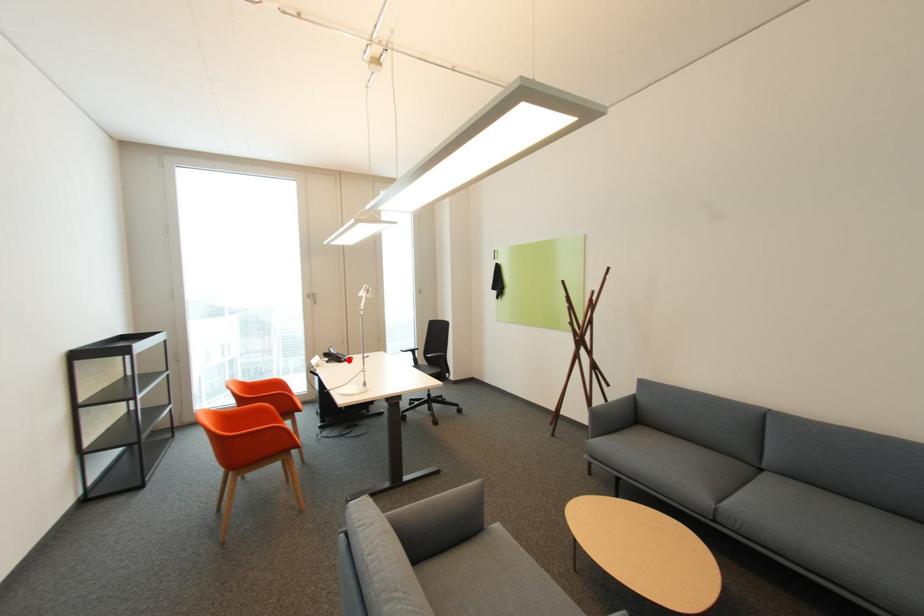
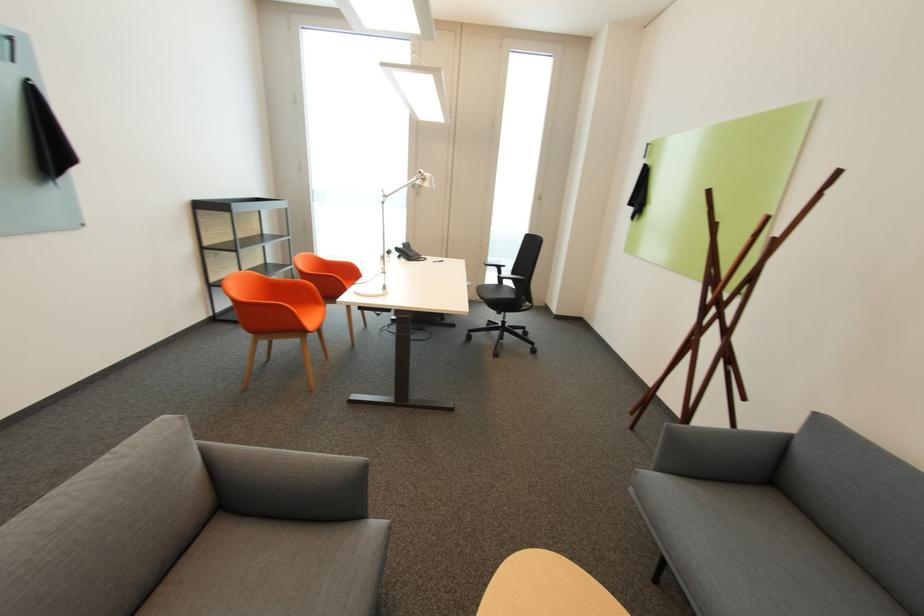
Question: I am providing you with two images of the same scene from different viewpoints. Given a red point in image1, look at the same physical point in image2. Is it:

Choices:
 (A) Closer to the viewpoint
 (B) Farther from the viewpoint

Answer: (A)